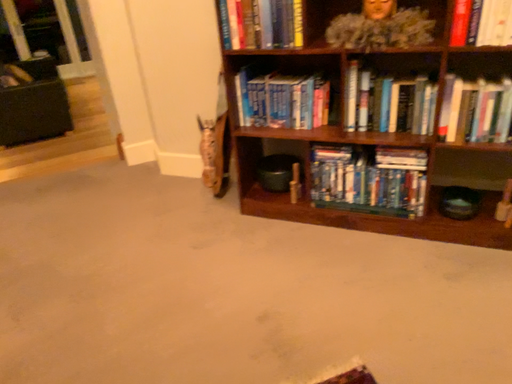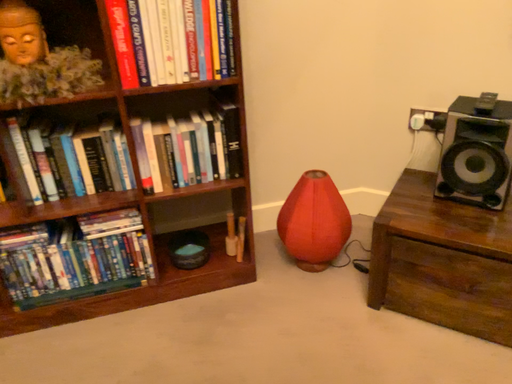
Question: Which way did the camera rotate in the video?

Choices:
 (A) rotated downward
 (B) rotated upward

Answer: (B)